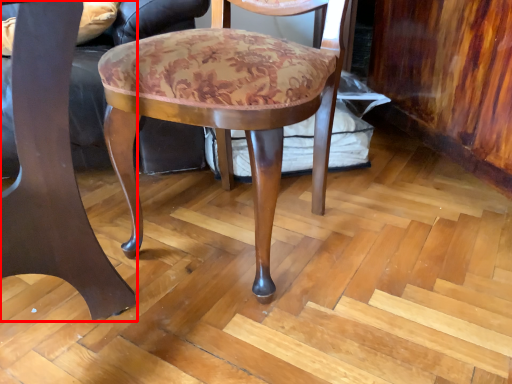
Question: From the image's perspective, what is the correct spatial relationship of chair (annotated by the red box) in relation to chair?

Choices:
 (A) above
 (B) below

Answer: (B)